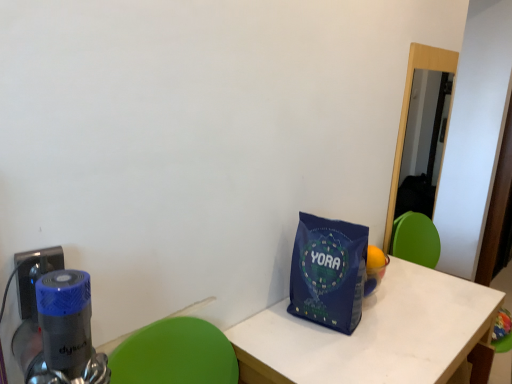
I want to click on unoccupied region to the right of blue fabric tote bag at lower right, so click(395, 326).